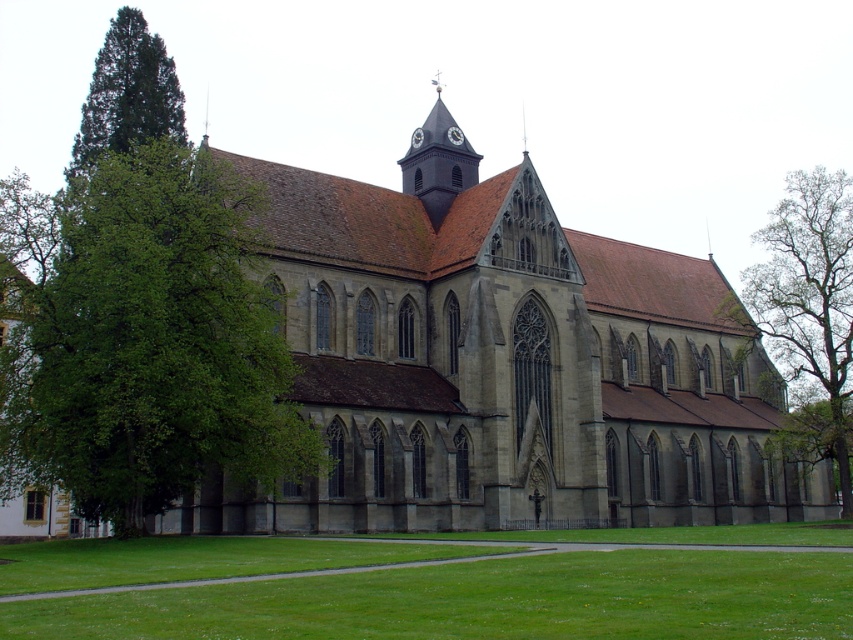
You are standing in front of the church and want to take a photo of the smooth brown clock tower at upper center without the green leafy tree at right blocking the view. Where should you position yourself relative to the tree?

You should position yourself to the left of the green leafy tree at right so that the tree is out of the frame, allowing a clear view of the smooth brown clock tower at upper center.

You are standing on the green lawn in front of the historic church. You see the green coniferous tree at left and the smooth brown clock tower at upper center. Which object is closer to you?

The green coniferous tree at left is closer to you because it is in front of the smooth brown clock tower at upper center.

You are a landscape architect planning to add a new pathway between the green leafy tree at right and the smooth brown clock tower at upper center. Since the pathway should be wide enough to accommodate a 3 meter wide cart, can you confirm if the space between them is sufficient?

The green leafy tree at right is wider than the smooth brown clock tower at upper center. However, the description only provides information about their widths relative to each other, not the actual distance between them. Without knowing the exact distance between the two objects, it is impossible to determine if the pathway will be wide enough for a 3 meter wide cart.